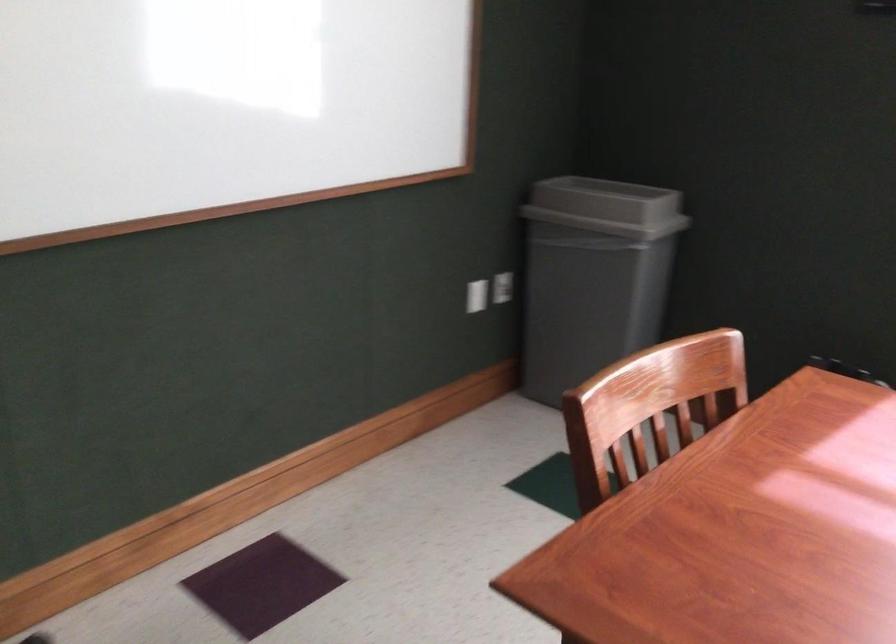
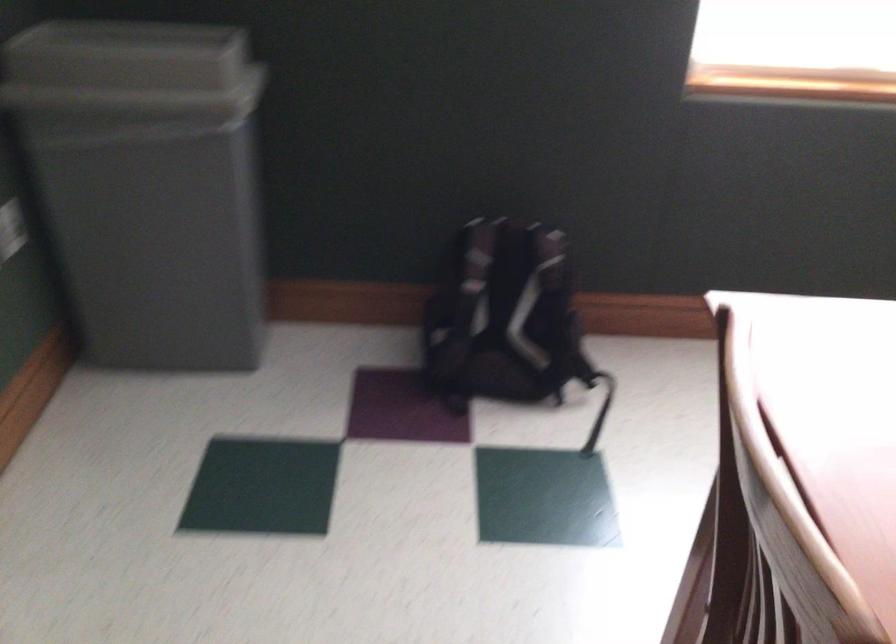
Where in the second image is the point corresponding to point 582,203 from the first image?

(131, 71)